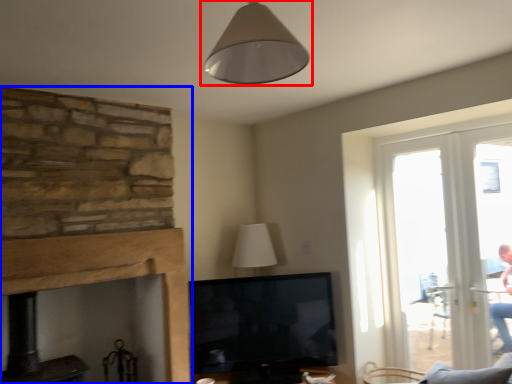
Question: Which point is further to the camera, lamp (highlighted by a red box) or fireplace (highlighted by a blue box)?

Choices:
 (A) lamp
 (B) fireplace

Answer: (B)